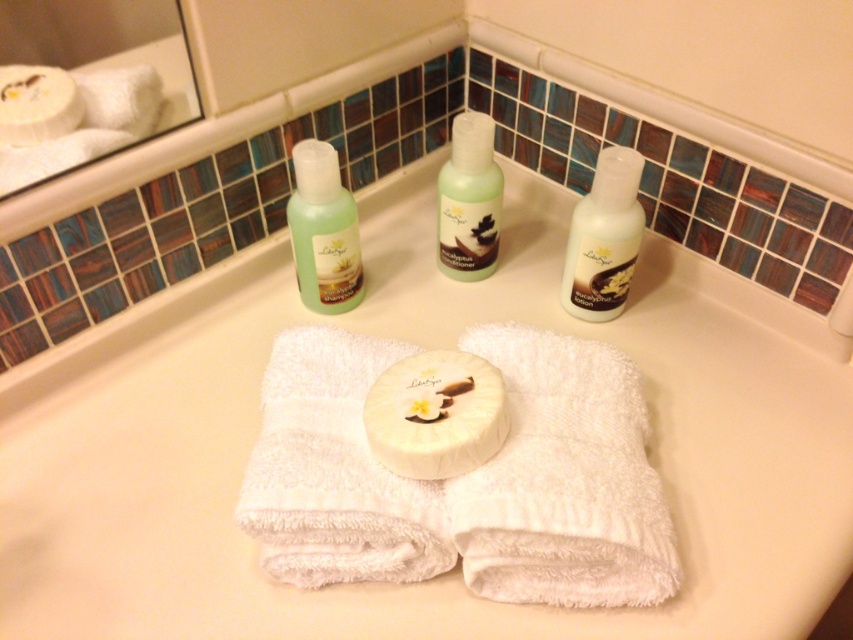
Can you confirm if white terry cloth towel at center is smaller than green translucent shampoo at upper center?

Incorrect, white terry cloth towel at center is not smaller in size than green translucent shampoo at upper center.

Is white terry cloth towel at center above green translucent shampoo at upper center?

Incorrect, white terry cloth towel at center is not positioned above green translucent shampoo at upper center.

Is point (544, 504) positioned before point (328, 253)?

That is True.

Where is `white terry cloth towel at center`? white terry cloth towel at center is located at coordinates pos(463,477).

Looking at this image, who is more distant from viewer, (664, 508) or (479, 220)?

Point (479, 220)

Measure the distance from white terry cloth towel at center to translucent plastic bottle at center.

A distance of 13.50 inches exists between white terry cloth towel at center and translucent plastic bottle at center.

Is point (325, 516) more distant than point (490, 211)?

No.

I want to click on white terry cloth towel at center, so click(x=463, y=477).

Which is more to the right, white terry cloth towel at center or white matte soap at center?

From the viewer's perspective, white terry cloth towel at center appears more on the right side.

This screenshot has height=640, width=853. What do you see at coordinates (463, 477) in the screenshot?
I see `white terry cloth towel at center` at bounding box center [463, 477].

Between point (547, 592) and point (386, 385), which one is positioned in front?

Point (547, 592) is more forward.

Locate an element on the screen. The image size is (853, 640). white terry cloth towel at center is located at coordinates (463, 477).